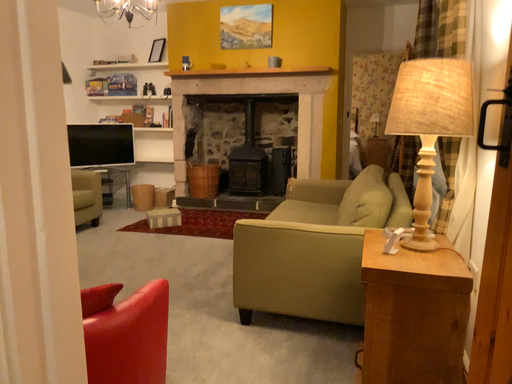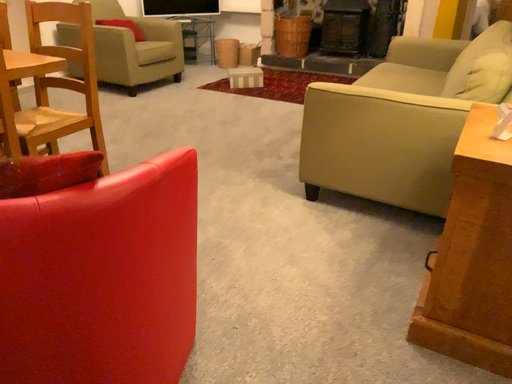
Question: Which way did the camera rotate in the video?

Choices:
 (A) rotated right
 (B) rotated left

Answer: (B)